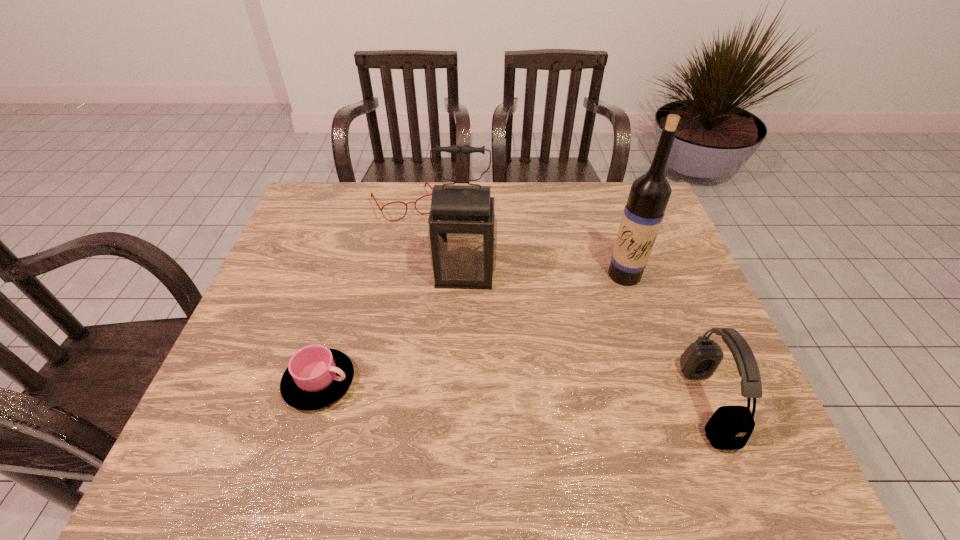
I want to click on vacant spot on the desktop that is between the cup and the headset and is positioned on the label of the wine bottle, so click(x=535, y=394).

I want to click on free space on the desktop that is between the cup and the rightmost object and is positioned on the front-facing side of the lantern, so pyautogui.click(x=454, y=389).

The width and height of the screenshot is (960, 540). I want to click on vacant space on the desktop that is between the cup and the third tallest object and is positioned on the face of the farthest object, so click(493, 392).